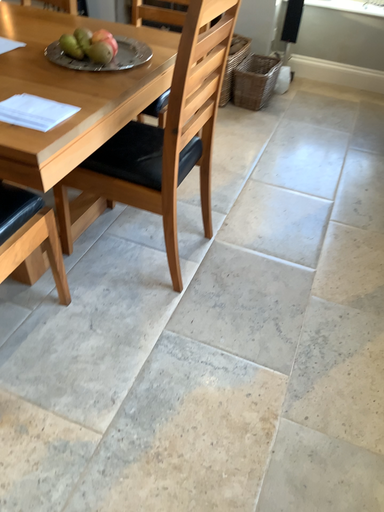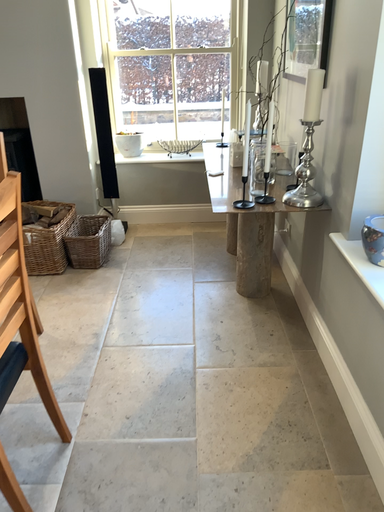
Question: How did the camera likely rotate when shooting the video?

Choices:
 (A) rotated downward
 (B) rotated upward

Answer: (B)